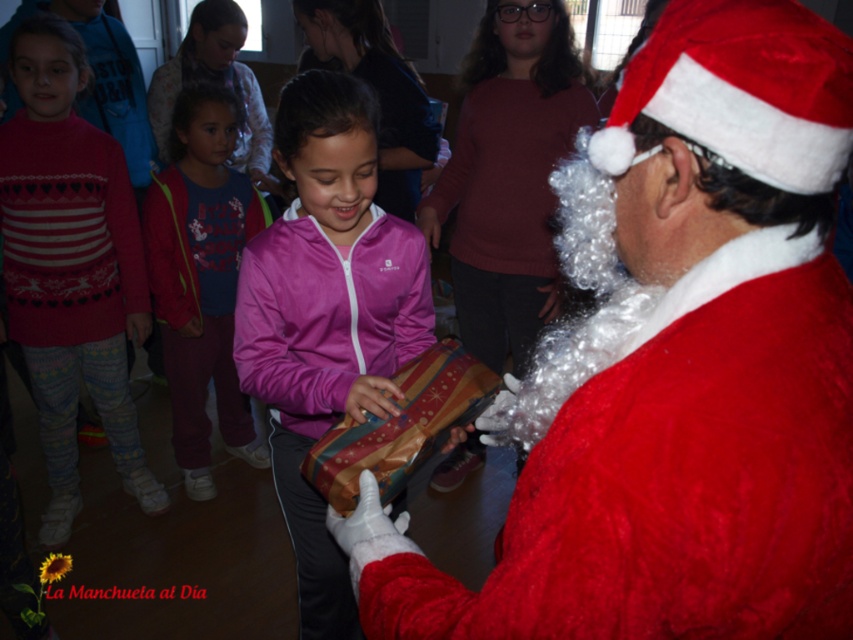
Can you confirm if matte pink jacket at center is shorter than shiny metallic gift at center?

In fact, matte pink jacket at center may be taller than shiny metallic gift at center.

Does matte pink jacket at center have a greater width compared to shiny metallic gift at center?

Yes, matte pink jacket at center is wider than shiny metallic gift at center.

Is point (164, 218) in front of point (437, 422)?

No, (164, 218) is behind (437, 422).

At what (x,y) coordinates should I click in order to perform the action: click on matte pink jacket at center. Please return your answer as a coordinate pair (x, y). The image size is (853, 640). Looking at the image, I should click on (201, 276).

Between point (73, 317) and point (421, 460), which one is positioned behind?

The point (73, 317) is more distant.

Which of these two, knitted sweater at left or shiny metallic gift at center, stands shorter?

shiny metallic gift at center is shorter.

Measure the distance between point [126,433] and camera.

Point [126,433] and camera are 8.35 feet apart.

Locate an element on the screen. This screenshot has height=640, width=853. knitted sweater at left is located at coordinates (70, 266).

Can you confirm if velvet red santa claus at center is taller than shiny metallic gift at center?

Yes.

Is velvet red santa claus at center positioned behind shiny metallic gift at center?

No, velvet red santa claus at center is in front of shiny metallic gift at center.

The image size is (853, 640). What are the coordinates of `velvet red santa claus at center` in the screenshot? It's located at (677, 365).